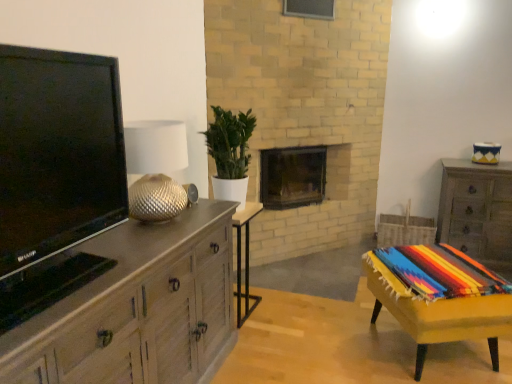
The height and width of the screenshot is (384, 512). Find the location of `matte black tv at left`. matte black tv at left is located at coordinates (56, 173).

Where is `green leafy plant at center`? Image resolution: width=512 pixels, height=384 pixels. green leafy plant at center is located at coordinates (230, 142).

What do you see at coordinates (439, 314) in the screenshot? I see `yellow fabric-covered table at lower right, the second table when ordered from left to right` at bounding box center [439, 314].

This screenshot has width=512, height=384. Describe the element at coordinates (135, 307) in the screenshot. I see `light wood/wooden chest of drawers at left, the 1th chest of drawers positioned from the front` at that location.

Locate an element on the screen. The height and width of the screenshot is (384, 512). gold textured lampshade at left is located at coordinates (155, 168).

Describe the element at coordinates (441, 272) in the screenshot. I see `multicolored woven blanket at lower right` at that location.

The image size is (512, 384). Find the location of `matte black tv at left`. matte black tv at left is located at coordinates (56, 173).

Would you say wooden side table at center, the first table from the left, contains dark brown wood fireplace at center?

No, dark brown wood fireplace at center is not surrounded by wooden side table at center, the first table from the left.

Considering their positions, is wooden side table at center, the first table from the left, located in front of or behind dark brown wood fireplace at center?

wooden side table at center, the first table from the left, is positioned closer to the viewer than dark brown wood fireplace at center.

From their relative heights in the image, would you say wooden side table at center, the first table from the left, is taller or shorter than dark brown wood fireplace at center?

wooden side table at center, the first table from the left, is taller than dark brown wood fireplace at center.

What's the angular difference between matte black tv at left and wooden side table at center, which is the second table from right to left,'s facing directions?

The facing directions of matte black tv at left and wooden side table at center, which is the second table from right to left, are 1.61 degrees apart.

Is matte black tv at left inside the boundaries of wooden side table at center, which is the second table from right to left, or outside?

matte black tv at left is located beyond the bounds of wooden side table at center, which is the second table from right to left.

From the image's perspective, is matte black tv at left located above or below wooden side table at center, which is the second table from right to left?

Clearly, from the image's perspective, matte black tv at left is above wooden side table at center, which is the second table from right to left.

Considering the sizes of objects matte black tv at left and wooden side table at center, which is the second table from right to left, in the image provided, who is wider, matte black tv at left or wooden side table at center, which is the second table from right to left,?

matte black tv at left is wider.

Is wooden side table at center, the first table from the left, to the left of multicolored woven blanket at lower right from the viewer's perspective?

Yes, wooden side table at center, the first table from the left, is to the left of multicolored woven blanket at lower right.

Considering the sizes of objects wooden side table at center, which is the second table from right to left, and multicolored woven blanket at lower right in the image provided, who is bigger, wooden side table at center, which is the second table from right to left, or multicolored woven blanket at lower right?

With larger size is wooden side table at center, which is the second table from right to left.

From a real-world perspective, who is located higher, wooden side table at center, the first table from the left, or multicolored woven blanket at lower right?

multicolored woven blanket at lower right.

Based on the photo, are wooden side table at center, which is the second table from right to left, and multicolored woven blanket at lower right located far from each other?

wooden side table at center, which is the second table from right to left, is far away from multicolored woven blanket at lower right.

Considering the sizes of objects green leafy plant at center and multicolored woven blanket at lower right in the image provided, who is taller, green leafy plant at center or multicolored woven blanket at lower right?

With more height is green leafy plant at center.

Which is less distant, [238,170] or [457,259]?

Clearly, point [238,170] is more distant from the camera than point [457,259].

Is green leafy plant at center located outside multicolored woven blanket at lower right?

Yes.

Does multicolored woven blanket at lower right have a smaller size compared to wooden side table at center, which is the second table from right to left?

Indeed, multicolored woven blanket at lower right has a smaller size compared to wooden side table at center, which is the second table from right to left.

Consider the image. Is multicolored woven blanket at lower right positioned with its back to wooden side table at center, the first table from the left?

No, wooden side table at center, the first table from the left, is not at the back of multicolored woven blanket at lower right.

Is multicolored woven blanket at lower right far away from wooden side table at center, the first table from the left?

Yes, multicolored woven blanket at lower right and wooden side table at center, the first table from the left, are located far from each other.

Is point (442, 251) closer to viewer compared to point (327, 163)?

That is True.

Measure the distance between multicolored woven blanket at lower right and dark brown wood fireplace at center.

multicolored woven blanket at lower right is 1.34 meters away from dark brown wood fireplace at center.

Considering the relative sizes of multicolored woven blanket at lower right and dark brown wood fireplace at center in the image provided, is multicolored woven blanket at lower right thinner than dark brown wood fireplace at center?

Incorrect, the width of multicolored woven blanket at lower right is not less than that of dark brown wood fireplace at center.

Would you say multicolored woven blanket at lower right is inside or outside dark brown wood fireplace at center?

multicolored woven blanket at lower right is not enclosed by dark brown wood fireplace at center.

Is dark brown wood fireplace at center aimed at matte black tv at left?

No, dark brown wood fireplace at center is not oriented towards matte black tv at left.

Is dark brown wood fireplace at center not near matte black tv at left?

Yes, dark brown wood fireplace at center and matte black tv at left are quite far apart.

Identify the location of fireplace lying on the right of wooden side table at center, the first table from the left. This screenshot has width=512, height=384. (298, 175).

I want to click on television that is on the left side of wooden side table at center, which is the second table from right to left, so (x=56, y=173).

Considering their positions, is matte black tv at left positioned further to light wood/wooden chest of drawers at left, which ranks as the 2th chest of drawers in right-to-left order, than wooden chest of drawers at right, the 2th chest of drawers positioned from the left?

wooden chest of drawers at right, the 2th chest of drawers positioned from the left, is positioned further to the anchor light wood/wooden chest of drawers at left, which ranks as the 2th chest of drawers in right-to-left order.

When comparing their distances from multicolored woven blanket at lower right, does dark brown wood fireplace at center or matte black tv at left seem closer?

Among the two, dark brown wood fireplace at center is located nearer to multicolored woven blanket at lower right.

When comparing their distances from light wood/wooden chest of drawers at left, arranged as the first chest of drawers when viewed from the left, does dark brown wood fireplace at center or matte black tv at left seem closer?

matte black tv at left is positioned closer to the anchor light wood/wooden chest of drawers at left, arranged as the first chest of drawers when viewed from the left.

Based on their spatial positions, is matte black tv at left or wooden side table at center, the first table from the left, closer to yellow fabric-covered table at lower right, the first table viewed from the right?

Among the two, wooden side table at center, the first table from the left, is located nearer to yellow fabric-covered table at lower right, the first table viewed from the right.

When comparing their distances from gold textured lampshade at left, does yellow fabric-covered table at lower right, the first table viewed from the right, or wooden chest of drawers at right, which is the first chest of drawers from right to left, seem further?

wooden chest of drawers at right, which is the first chest of drawers from right to left.

Which object lies nearer to the anchor point multicolored woven blanket at lower right, green leafy plant at center or gold textured lampshade at left?

green leafy plant at center lies closer to multicolored woven blanket at lower right than the other object.

Which object lies nearer to the anchor point green leafy plant at center, matte black tv at left or wooden chest of drawers at right, which is the first chest of drawers from right to left?

Among the two, matte black tv at left is located nearer to green leafy plant at center.

When comparing their distances from wooden chest of drawers at right, positioned as the 1th chest of drawers in back-to-front order, does light wood/wooden chest of drawers at left, arranged as the first chest of drawers when viewed from the left, or matte black tv at left seem further?

matte black tv at left.

Where is `table between yellow fabric-covered table at lower right, the first table viewed from the right, and dark brown wood fireplace at center from front to back`? Image resolution: width=512 pixels, height=384 pixels. table between yellow fabric-covered table at lower right, the first table viewed from the right, and dark brown wood fireplace at center from front to back is located at coordinates (245, 259).

You are a GUI agent. You are given a task and a screenshot of the screen. Output one action in this format:
    pyautogui.click(x=<x>, y=<y>)
    Task: Click on the blanket positioned between light wood/wooden chest of drawers at left, the 1th chest of drawers positioned from the front, and dark brown wood fireplace at center from near to far
    The width and height of the screenshot is (512, 384).
    Given the screenshot: What is the action you would take?
    pyautogui.click(x=441, y=272)

The width and height of the screenshot is (512, 384). I want to click on table between gold textured lampshade at left and multicolored woven blanket at lower right, so click(245, 259).

Image resolution: width=512 pixels, height=384 pixels. I want to click on plant between light wood/wooden chest of drawers at left, which ranks as the 2th chest of drawers in right-to-left order, and yellow fabric-covered table at lower right, the first table viewed from the right, from left to right, so click(230, 142).